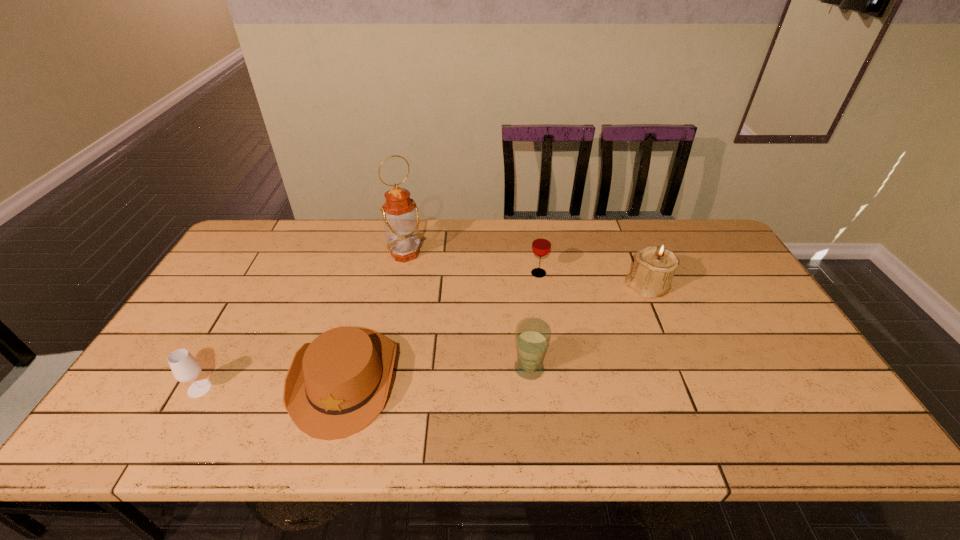
What are the coordinates of `vacant space that satisfies the following two spatial constraints: 1. on the front side of the candle_holder; 2. on the right side of the farthest glass` in the screenshot? It's located at tap(540, 286).

Where is `free point that satisfies the following two spatial constraints: 1. on the front side of the rightmost object; 2. on the left side of the oil lamp`? The height and width of the screenshot is (540, 960). free point that satisfies the following two spatial constraints: 1. on the front side of the rightmost object; 2. on the left side of the oil lamp is located at coordinates (399, 286).